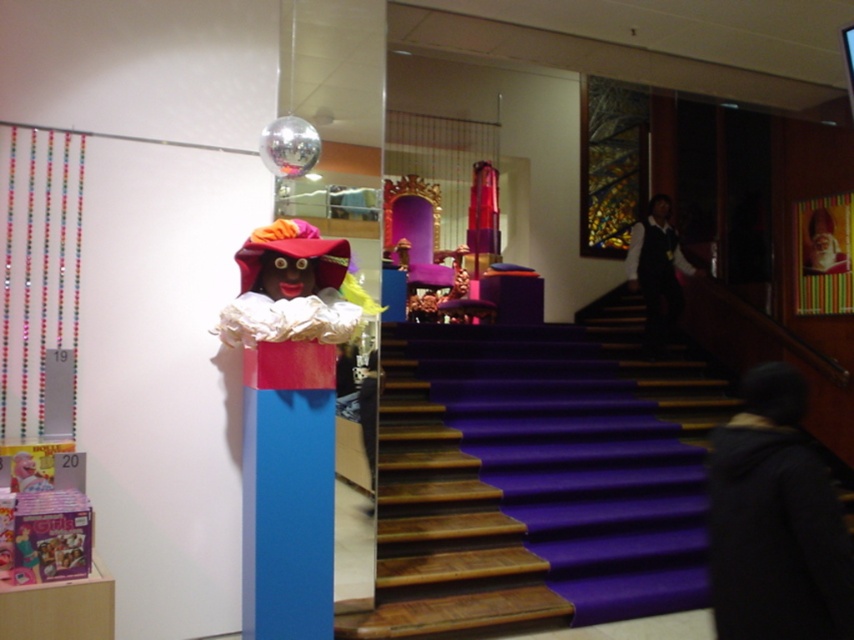
Question: Which point appears farthest from the camera in this image?

Choices:
 (A) (330, 284)
 (B) (799, 540)
 (C) (664, 333)
 (D) (828, 220)

Answer: (C)

Question: Does black fabric at lower right have a smaller size compared to smooth plastic santa at upper right?

Choices:
 (A) yes
 (B) no

Answer: (B)

Question: Is black fabric at lower right further to camera compared to matte pink fabric doll at center?

Choices:
 (A) yes
 (B) no

Answer: (B)

Question: Based on their relative distances, which object is farther from the dark fabric dress at upper right?

Choices:
 (A) smooth plastic santa at upper right
 (B) black fabric at lower right
 (C) blue matte column at center

Answer: (B)

Question: Is matte pink fabric doll at center below smooth plastic santa at upper right?

Choices:
 (A) no
 (B) yes

Answer: (B)

Question: Among these points, which one is farthest from the camera?

Choices:
 (A) (249, 364)
 (B) (646, 248)

Answer: (B)